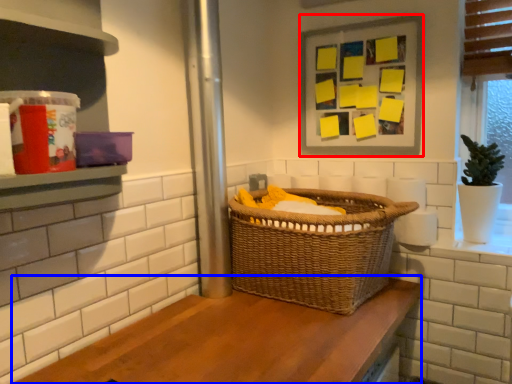
Question: Which of the following is the closest to the observer, picture frame (highlighted by a red box) or counter (highlighted by a blue box)?

Choices:
 (A) picture frame
 (B) counter

Answer: (B)